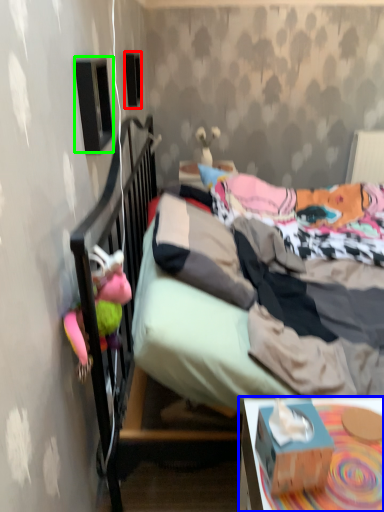
Question: Based on their relative distances, which object is nearer to loudspeaker (highlighted by a red box)? Choose from desk (highlighted by a blue box) and loudspeaker (highlighted by a green box).

Choices:
 (A) desk
 (B) loudspeaker

Answer: (B)